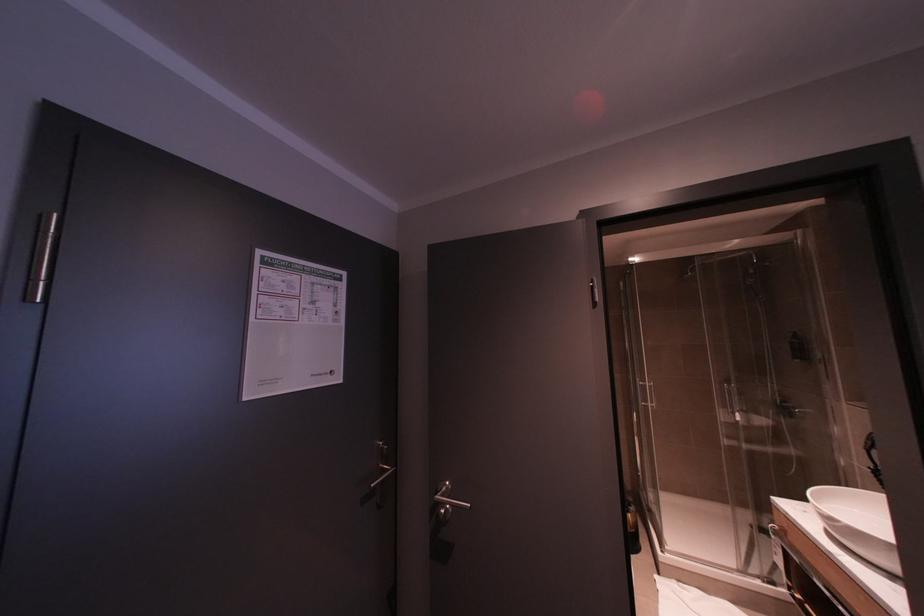
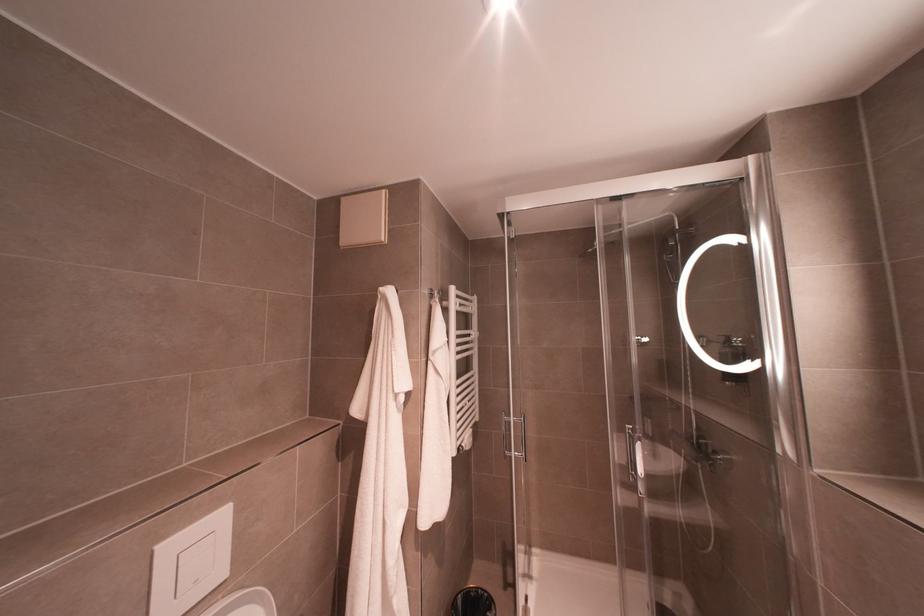
What movement of the cameraman would produce the second image?

The cameraman walked toward right, forward.